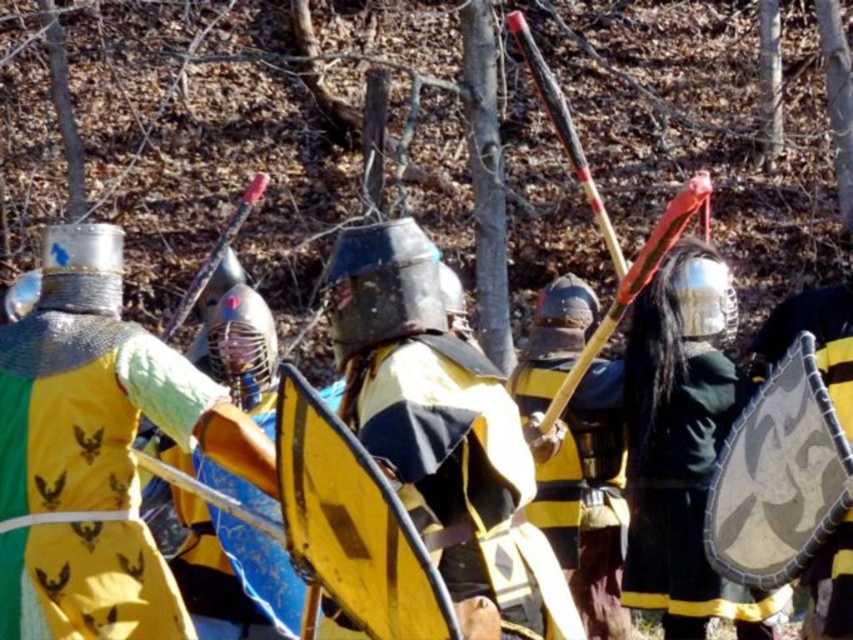
You are a knight in the medieval battle scene. Your objective is to reach a hidden treasure located at point (474,445). If you start moving directly towards this point from your current position, how far will you have to travel in meters?

The distance between point (474,445) and the camera is 19.76 meters, so you will have to travel 19.76 meters to reach the treasure located at point (474,445).

You are a participant in the medieval reenactment and need to retrieve your yellow fabric shield at center. You are currently standing in front of the yellow and black armor at center. Can you reach your shield without moving past the armor?

The yellow fabric shield at center is further to the viewer than the yellow and black armor at center, so you can reach it without moving past the armor since it is closer to you.